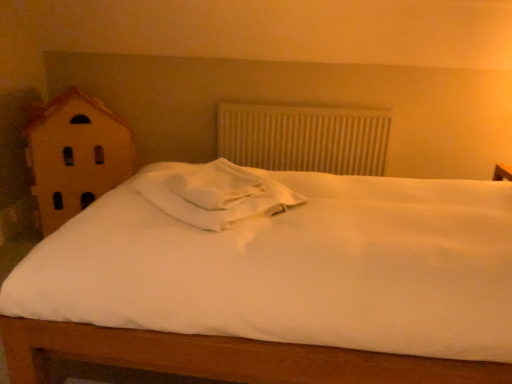
You are a GUI agent. You are given a task and a screenshot of the screen. Output one action in this format:
    pyautogui.click(x=<x>, y=<y>)
    Task: Click on the white textured radiator at center
    
    Given the screenshot: What is the action you would take?
    pyautogui.click(x=304, y=138)

Measure the distance between white textured radiator at center and camera.

The depth of white textured radiator at center is 7.97 feet.

The image size is (512, 384). I want to click on white soft pillow at center, so click(x=215, y=194).

At what (x,y) coordinates should I click in order to perform the action: click on wooden house at left. Please return your answer as a coordinate pair (x, y). Image resolution: width=512 pixels, height=384 pixels. Looking at the image, I should click on (75, 154).

Is white soft pillow at center wider than white textured radiator at center?

Correct, the width of white soft pillow at center exceeds that of white textured radiator at center.

From the picture: From a real-world perspective, which is physically above, white soft pillow at center or white textured radiator at center?

white soft pillow at center.

Is point (249, 186) positioned after point (260, 130)?

No, (249, 186) is closer to viewer.

Would you say white soft pillow at center is a long distance from white textured radiator at center?

No, white soft pillow at center is not far away from white textured radiator at center.

Can you confirm if white soft pillow at center is taller than wooden house at left?

No, white soft pillow at center is not taller than wooden house at left.

Which is nearer, (x=170, y=201) or (x=110, y=169)?

Point (x=170, y=201) is positioned closer to the camera compared to point (x=110, y=169).

Locate an element on the screen. This screenshot has width=512, height=384. pillow in front of the wooden house at left is located at coordinates (215, 194).

From the picture: Is white soft pillow at center positioned with its back to wooden house at left?

white soft pillow at center does not have its back to wooden house at left.

Considering their positions, is white textured radiator at center located in front of or behind white soft pillow at center?

Visually, white textured radiator at center is located behind white soft pillow at center.

From the image's perspective, which one is positioned higher, white textured radiator at center or white soft pillow at center?

white textured radiator at center.

Is white soft pillow at center inside white textured radiator at center?

That's incorrect, white soft pillow at center is not inside white textured radiator at center.

Are white textured radiator at center and white soft pillow at center far apart?

That's not correct — white textured radiator at center is a little close to white soft pillow at center.

Which of these two, wooden house at left or white textured radiator at center, is bigger?

Bigger between the two is wooden house at left.

Which of these two, wooden house at left or white textured radiator at center, is thinner?

white textured radiator at center.

From a real-world perspective, is wooden house at left beneath white textured radiator at center?

Correct, in the physical world, wooden house at left is lower than white textured radiator at center.

Between wooden house at left and white textured radiator at center, which one is positioned in front?

Positioned in front is wooden house at left.

What's the angular difference between wooden house at left and white soft pillow at center's facing directions?

The angular difference between wooden house at left and white soft pillow at center is 77.5 degrees.

Is point (44, 213) closer or farther from the camera than point (253, 198)?

Point (44, 213) is positioned farther from the camera compared to point (253, 198).

Identify the location of pillow above the wooden house at left (from a real-world perspective). (215, 194).

Is wooden house at left in front of white soft pillow at center?

No, wooden house at left is further to the viewer.

Is white textured radiator at center at the right side of wooden house at left?

Correct, you'll find white textured radiator at center to the right of wooden house at left.

Based on their sizes in the image, would you say white textured radiator at center is bigger or smaller than wooden house at left?

Considering their sizes, white textured radiator at center takes up less space than wooden house at left.

Is white textured radiator at center in front of or behind wooden house at left in the image?

Clearly, white textured radiator at center is behind wooden house at left.

Could you tell me if white textured radiator at center is facing wooden house at left?

No.

Locate an element on the screen. This screenshot has width=512, height=384. radiator located underneath the white soft pillow at center (from a real-world perspective) is located at coordinates (304, 138).

The height and width of the screenshot is (384, 512). In the image, there is a white soft pillow at center. What are the coordinates of `toy above it (from the image's perspective)` in the screenshot? It's located at (75, 154).

Which object lies nearer to the anchor point white soft pillow at center, white textured radiator at center or wooden house at left?

Based on the image, wooden house at left appears to be nearer to white soft pillow at center.

When comparing their distances from white soft pillow at center, does wooden house at left or white textured radiator at center seem further?

white textured radiator at center is positioned further to the anchor white soft pillow at center.

Based on their spatial positions, is white textured radiator at center or white soft pillow at center further from wooden house at left?

Among the two, white soft pillow at center is located further to wooden house at left.

From the image, which object appears to be farther from wooden house at left, white soft pillow at center or white textured radiator at center?

Among the two, white soft pillow at center is located further to wooden house at left.

Looking at the image, which one is located closer to white textured radiator at center, wooden house at left or white soft pillow at center?

wooden house at left is closer to white textured radiator at center.

Considering their positions, is white soft pillow at center positioned closer to white textured radiator at center than wooden house at left?

wooden house at left lies closer to white textured radiator at center than the other object.

Identify the location of pillow between wooden house at left and white textured radiator at center. (215, 194).